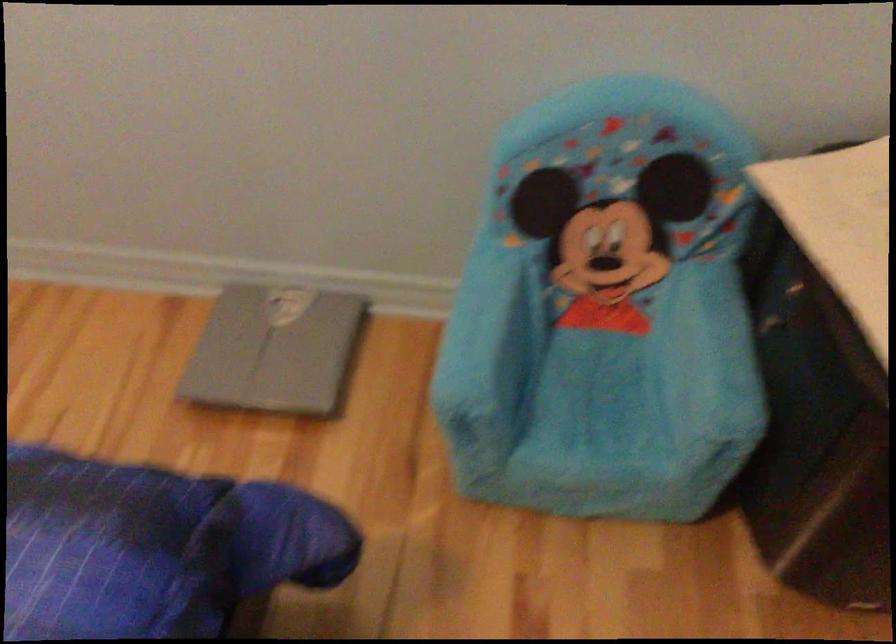
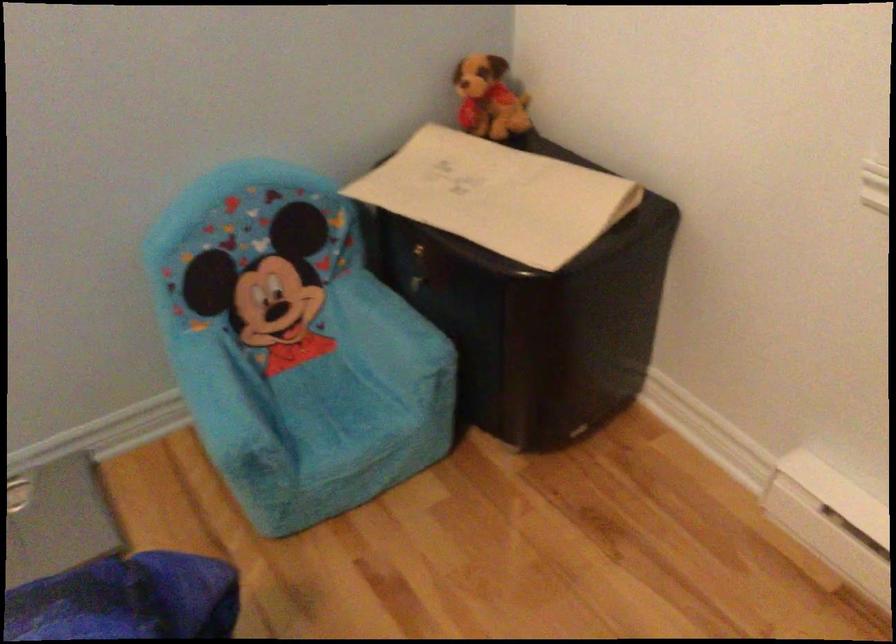
Question: The first image is from the beginning of the video and the second image is from the end. How did the camera likely rotate when shooting the video?

Choices:
 (A) Left
 (B) Right
 (C) Up
 (D) Down

Answer: (B)